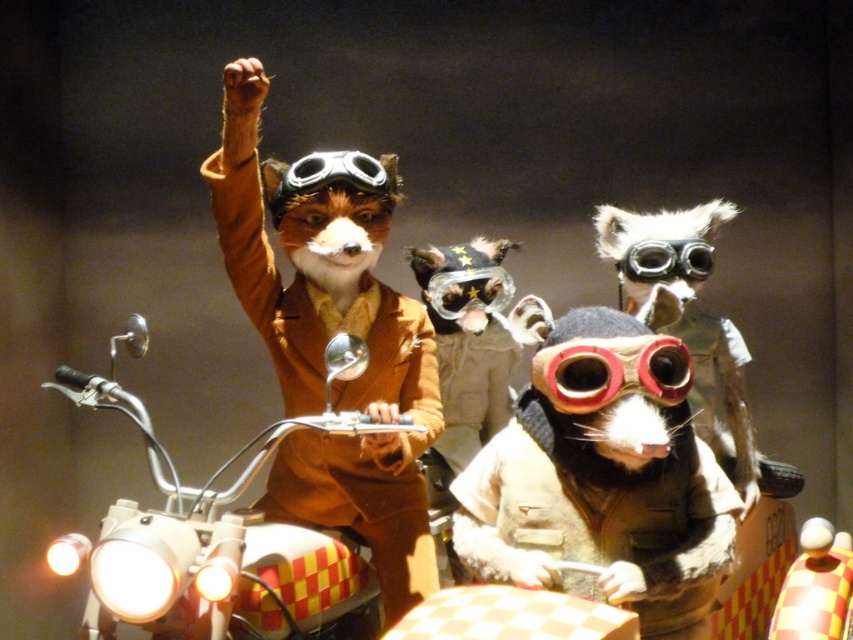
Based on the scene description, can you determine if the fuzzy beige vest at center is wider than the shiny metallic goggles at center?

The fuzzy beige vest at center is wider than the shiny metallic goggles at center according to the description.

You are an engineer designing a virtual reality experience based on this image. You need to place a virtual spotlight that will illuminate the rubberized red goggles at center. According to the coordinates provided, where should you position the spotlight to ensure it directly faces the goggles?

The rubberized red goggles at center are located at point [611,371], so the spotlight should be positioned directly facing this coordinate to illuminate them effectively.